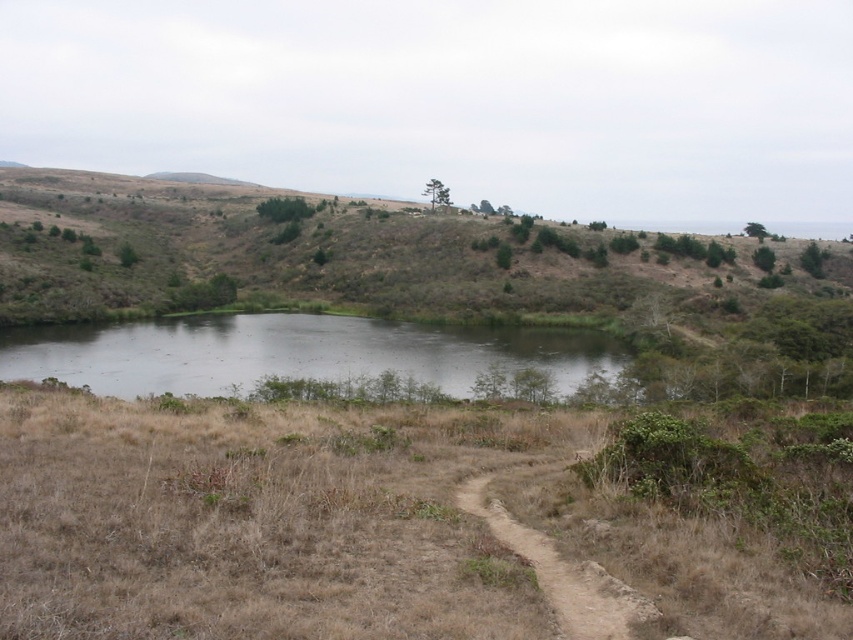
Question: Which point is closer to the camera taking this photo?

Choices:
 (A) coord(479,486)
 (B) coord(399,340)
 (C) coord(283,269)

Answer: (A)

Question: Which point appears closest to the camera in this image?

Choices:
 (A) (583, 573)
 (B) (621, 305)

Answer: (A)

Question: Which of the following is the farthest from the observer?

Choices:
 (A) (572, 260)
 (B) (311, 360)
 (C) (572, 572)

Answer: (A)

Question: Observing the image, what is the correct spatial positioning of brown grassy hillside at center in reference to gray reflective water at center?

Choices:
 (A) left
 (B) right

Answer: (A)

Question: Is gray reflective water at center below brown dirt path at center?

Choices:
 (A) no
 (B) yes

Answer: (A)

Question: Does brown grassy hillside at center appear under gray reflective water at center?

Choices:
 (A) no
 (B) yes

Answer: (A)